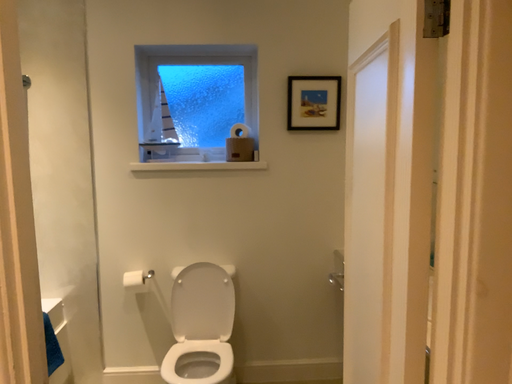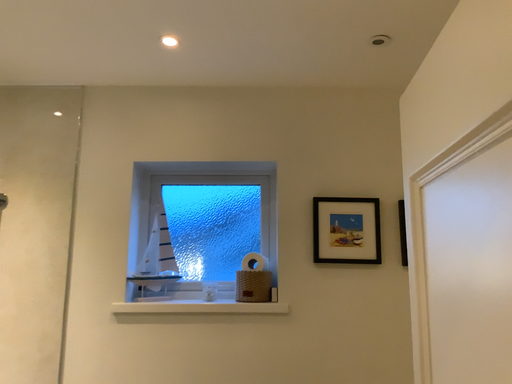
Question: Which way did the camera rotate in the video?

Choices:
 (A) rotated upward
 (B) rotated downward

Answer: (A)